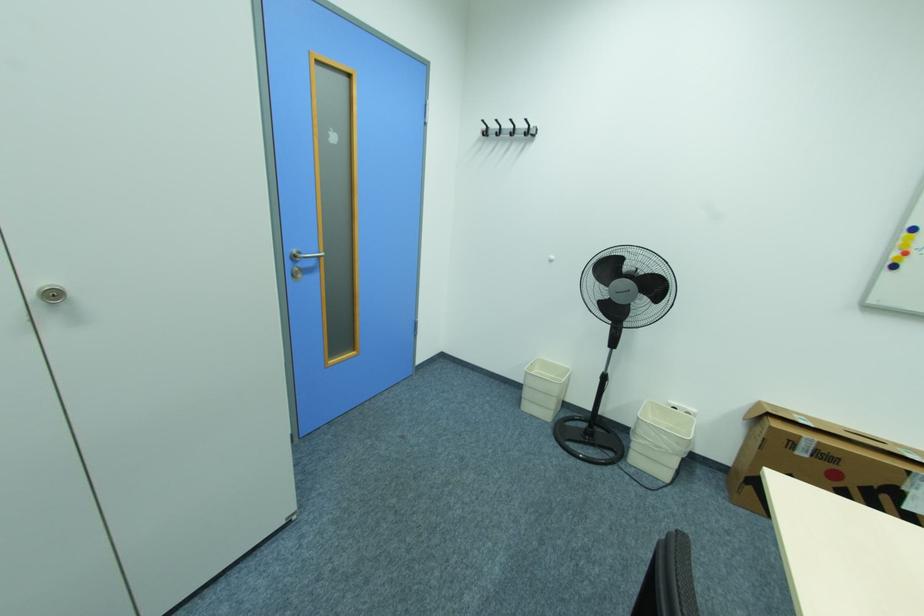
Locate an element on the screen. cabinet lock is located at coordinates (52, 294).